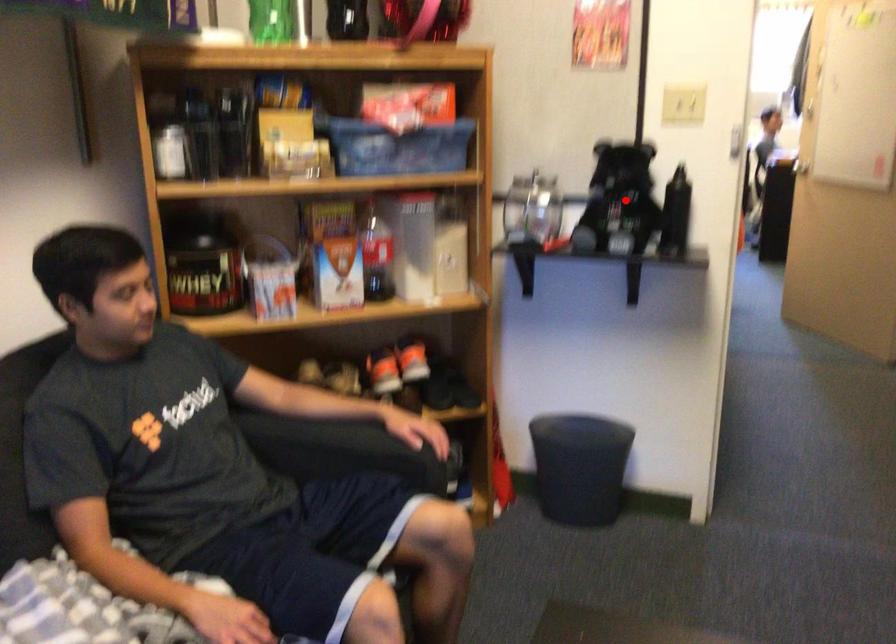
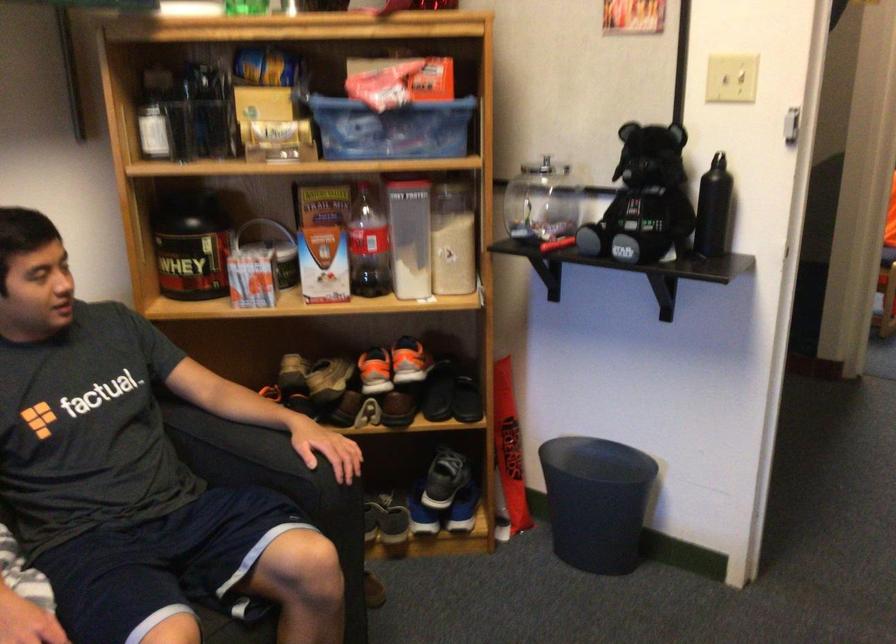
Question: I am providing you with two images of the same scene from different viewpoints. In image1, a red point is highlighted. Considering the same 3D point in image2, which of the following is correct?

Choices:
 (A) It is closer
 (B) It is farther

Answer: (A)